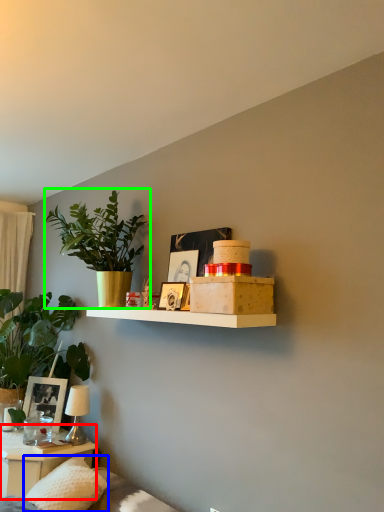
Question: Which is farther away from table (highlighted by a red box)? pillow (highlighted by a blue box) or houseplant (highlighted by a green box)?

Choices:
 (A) pillow
 (B) houseplant

Answer: (B)